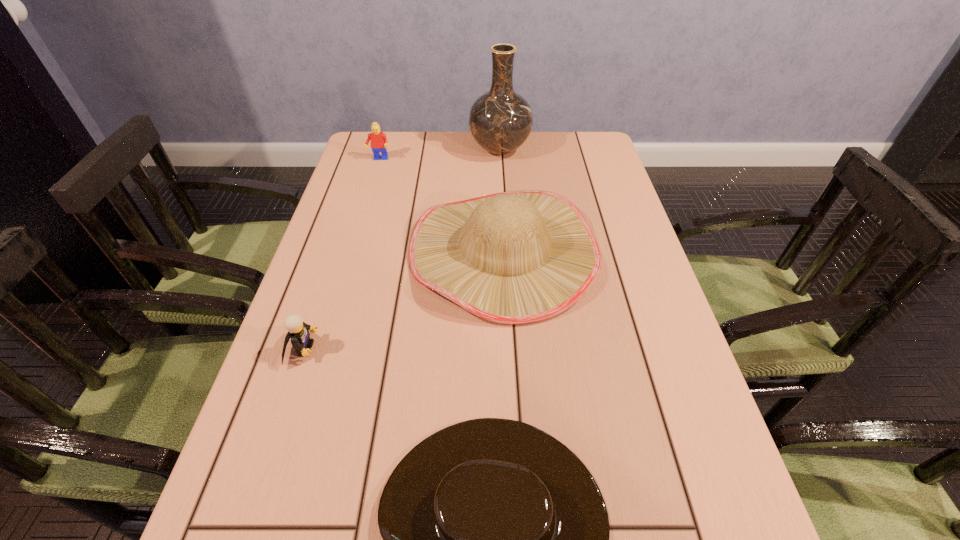
Where is `vacant area situated on the front-facing side of the shorter Lego`? vacant area situated on the front-facing side of the shorter Lego is located at coordinates (383, 349).

This screenshot has height=540, width=960. In order to click on vase that is at the far edge in this screenshot , I will do `click(500, 120)`.

Find the location of `Lego situated at the far edge`. Lego situated at the far edge is located at coordinates click(x=379, y=143).

You are a GUI agent. You are given a task and a screenshot of the screen. Output one action in this format:
    pyautogui.click(x=<x>, y=<y>)
    Task: Click on the object present at the right edge
    The height and width of the screenshot is (540, 960).
    Given the screenshot: What is the action you would take?
    pyautogui.click(x=519, y=257)

Identify the location of object that is positioned at the far left corner. (379, 143).

Identify the location of free region at the far edge of the desktop. (452, 147).

In the image, there is a desktop. Identify the location of free space at the left edge. This screenshot has height=540, width=960. (252, 487).

I want to click on vacant position at the right edge of the desktop, so click(644, 303).

The width and height of the screenshot is (960, 540). Identify the location of vacant space at the far left corner. (387, 170).

This screenshot has height=540, width=960. Identify the location of vacant region between the second tallest object and the shorter Lego. tap(403, 300).